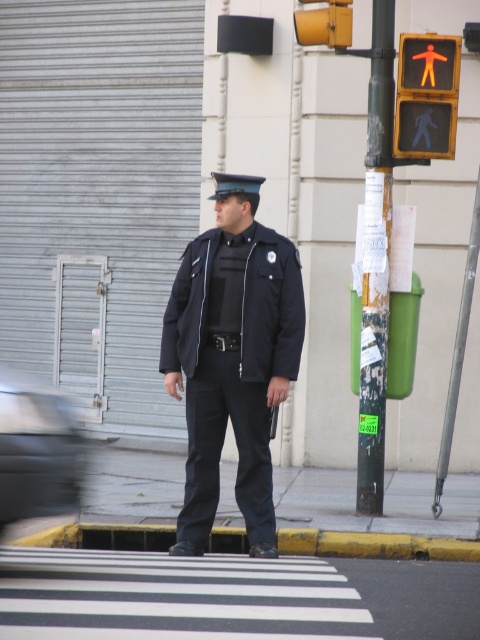
You are a delivery person standing at the camera position. You need to deliver a package to the point marked at coordinates point [409,106]. Can you reach it without moving past the traffic signal pole with the red pedestrian light?

The point [409,106] is 9.34 meters away from the camera, so you can reach it without moving past the traffic signal pole with the red pedestrian light.

You are a pedestrian waiting at the crosswalk. You see the matte black uniform at center and the yellow matte traffic light at upper center. Which object is closer to your left side?

The matte black uniform at center is positioned on the left side of yellow matte traffic light at upper center, so the matte black uniform at center is closer to your left side.

You are a delivery person who needs to cross the street at the pedestrian crossing. There is a point marked at coordinates point (427, 96). What object is located at that point?

The point (427, 96) is on the orange plastic pedestrian signal at upper right.